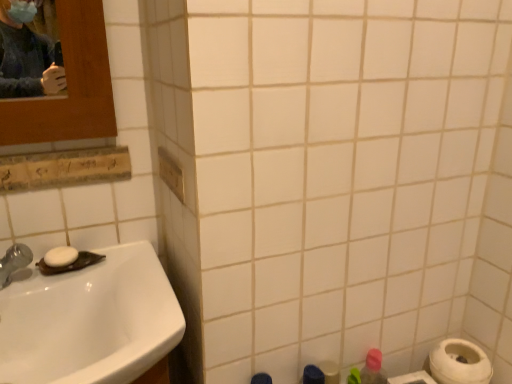
Question: Would you say pink matte bottle at lower right is part of white matte toilet paper at lower right's contents?

Choices:
 (A) yes
 (B) no

Answer: (B)

Question: Is white matte toilet paper at lower right oriented towards pink matte bottle at lower right?

Choices:
 (A) no
 (B) yes

Answer: (A)

Question: Considering the relative sizes of white matte toilet paper at lower right and pink matte bottle at lower right in the image provided, is white matte toilet paper at lower right bigger than pink matte bottle at lower right?

Choices:
 (A) no
 (B) yes

Answer: (B)

Question: Is white matte toilet paper at lower right shorter than pink matte bottle at lower right?

Choices:
 (A) no
 (B) yes

Answer: (B)

Question: Is white matte toilet paper at lower right positioned behind pink matte bottle at lower right?

Choices:
 (A) no
 (B) yes

Answer: (A)

Question: Visually, is white glossy sink at lower left positioned to the left or to the right of pink matte bottle at lower right?

Choices:
 (A) right
 (B) left

Answer: (B)

Question: Considering the positions of white glossy sink at lower left and pink matte bottle at lower right in the image, is white glossy sink at lower left wider or thinner than pink matte bottle at lower right?

Choices:
 (A) thin
 (B) wide

Answer: (B)

Question: Is white glossy sink at lower left inside the boundaries of pink matte bottle at lower right, or outside?

Choices:
 (A) inside
 (B) outside

Answer: (B)

Question: Considering the positions of white glossy sink at lower left and pink matte bottle at lower right in the image, is white glossy sink at lower left bigger or smaller than pink matte bottle at lower right?

Choices:
 (A) big
 (B) small

Answer: (A)

Question: Is white matte soap at sink left wider or thinner than pink matte bottle at lower right?

Choices:
 (A) thin
 (B) wide

Answer: (B)

Question: Is white matte soap at sink left situated inside pink matte bottle at lower right or outside?

Choices:
 (A) inside
 (B) outside

Answer: (B)

Question: Visually, is white matte soap at sink left positioned to the left or to the right of pink matte bottle at lower right?

Choices:
 (A) left
 (B) right

Answer: (A)

Question: From the image's perspective, is white matte soap at sink left positioned above or below pink matte bottle at lower right?

Choices:
 (A) below
 (B) above

Answer: (B)

Question: In terms of size, does pink matte bottle at lower right appear bigger or smaller than white glossy sink at lower left?

Choices:
 (A) small
 (B) big

Answer: (A)

Question: Is pink matte bottle at lower right inside or outside of white glossy sink at lower left?

Choices:
 (A) outside
 (B) inside

Answer: (A)